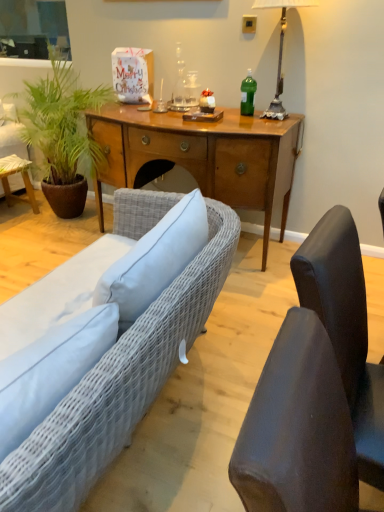
In order to click on blank space above wooden desk at center (from a real-world perspective) in this screenshot , I will do `click(196, 119)`.